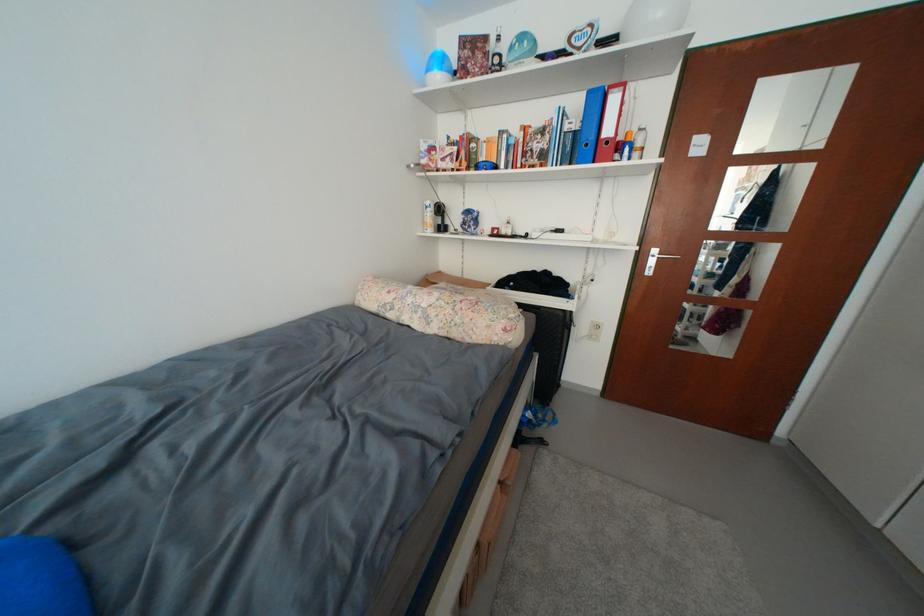
You are a GUI agent. You are given a task and a screenshot of the screen. Output one action in this format:
    pyautogui.click(x=<x>, y=<y>)
    Task: Click on the blue binder
    
    Given the screenshot: What is the action you would take?
    pyautogui.click(x=589, y=127)